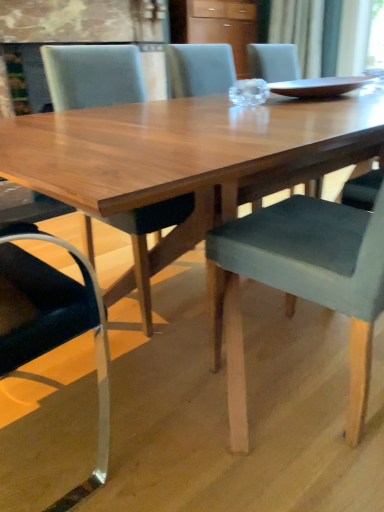
Question: Is point (342, 80) closer or farther from the camera than point (200, 18)?

Choices:
 (A) closer
 (B) farther

Answer: (A)

Question: From the image's perspective, relative to wooden cabinet at upper center, is matte brown tray at center above or below?

Choices:
 (A) below
 (B) above

Answer: (A)

Question: Considering the real-world distances, which object is farthest from the matte gray chair at center, which is the 2th chair from right to left?

Choices:
 (A) matte brown tray at center
 (B) velvet grey chair at center, the first chair when ordered from right to left
 (C) wooden cabinet at upper center

Answer: (C)

Question: Estimate the real-world distances between objects in this image. Which object is closer to the wooden cabinet at upper center?

Choices:
 (A) matte brown tray at center
 (B) matte gray chair at center, the first chair when ordered from left to right
 (C) velvet grey chair at center, the first chair when ordered from right to left

Answer: (A)